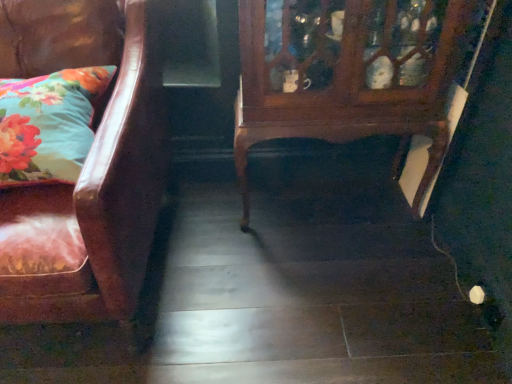
Image resolution: width=512 pixels, height=384 pixels. What are the coordinates of `free space below wooden cabinet at center (from a real-world perspective)` in the screenshot? It's located at (328, 208).